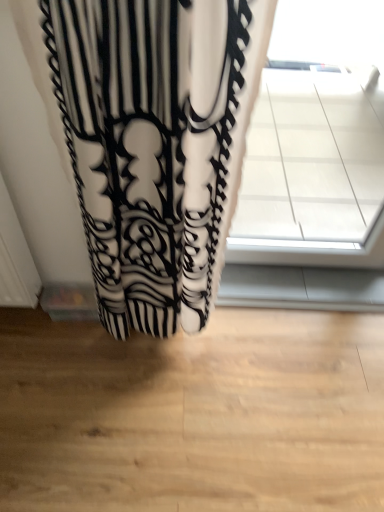
Locate an element on the screen. white tile at upper right is located at coordinates (312, 173).

What do you see at coordinates (312, 173) in the screenshot?
I see `white tile at upper right` at bounding box center [312, 173].

Looking at this image, in order to face white tile at upper right, should I rotate leftwards or rightwards?

Turn right approximately 18.875 degrees to face it.

At what (x,y) coordinates should I click in order to perform the action: click on white tile at upper right. Please return your answer as a coordinate pair (x, y). This screenshot has width=384, height=512. Looking at the image, I should click on (312, 173).